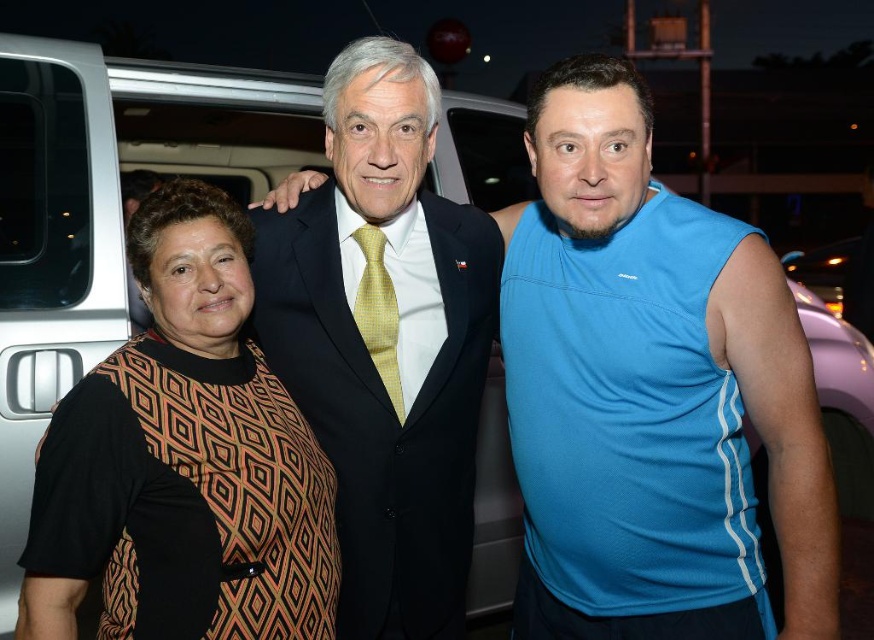
Can you confirm if patterned fabric dress at left is thinner than matte black suit at center?

Yes.

Is point (191, 248) closer to viewer compared to point (390, 84)?

Yes.

I want to click on patterned fabric dress at left, so click(x=184, y=461).

Can you confirm if blue mesh tank top at center is wider than matte black suit at center?

No, blue mesh tank top at center is not wider than matte black suit at center.

Identify the location of blue mesh tank top at center. The height and width of the screenshot is (640, 874). (651, 392).

Is point (660, 474) farther from viewer compared to point (200, 356)?

Yes, point (660, 474) is behind point (200, 356).

Measure the distance from blue mesh tank top at center to patterned fabric dress at left.

The distance of blue mesh tank top at center from patterned fabric dress at left is 29.29 inches.

Who is more distant from viewer, [540,468] or [325,605]?

The point [540,468] is behind.

Find the location of a particular element. blue mesh tank top at center is located at coordinates (651, 392).